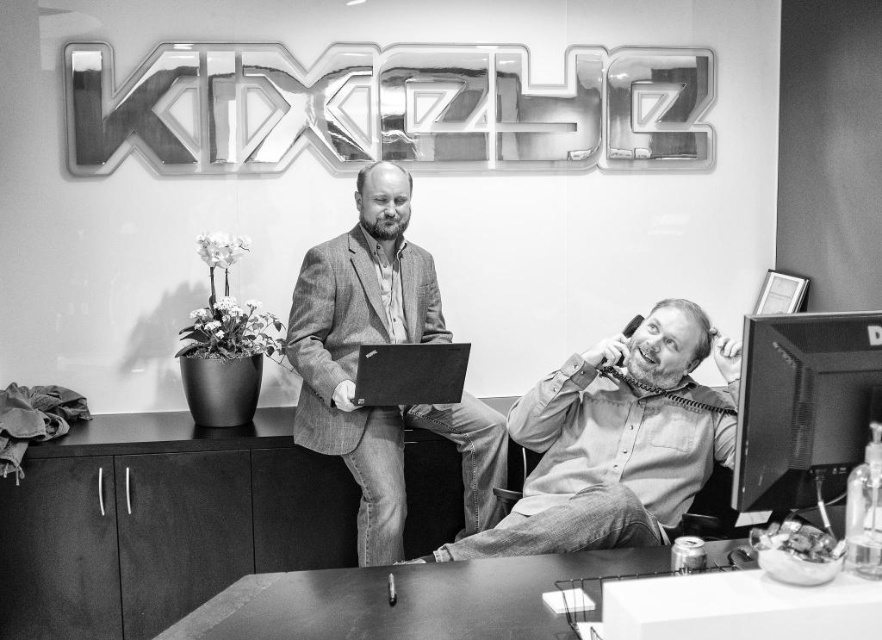
Is point (377, 602) behind point (774, 504)?

Yes, it is behind point (774, 504).

Is smooth wooden table at lower center behind matte black monitor at right?

Yes.

Is point (719, 560) farther from camera compared to point (748, 387)?

Yes, point (719, 560) is behind point (748, 387).

You are a GUI agent. You are given a task and a screenshot of the screen. Output one action in this format:
    pyautogui.click(x=<x>, y=<y>)
    Task: Click on the smooth wooden table at lower center
    The image size is (882, 640).
    Given the screenshot: What is the action you would take?
    pyautogui.click(x=410, y=600)

Is point (766, 442) closer to viewer compared to point (405, 365)?

Yes.

Is matte black monitor at right thinner than black matte laptop at center?

Correct, matte black monitor at right's width is less than black matte laptop at center's.

Is point (761, 376) less distant than point (371, 392)?

That is True.

You are a GUI agent. You are given a task and a screenshot of the screen. Output one action in this format:
    pyautogui.click(x=<x>, y=<y>)
    Task: Click on the matte black monitor at right
    This screenshot has height=640, width=882.
    Given the screenshot: What is the action you would take?
    pyautogui.click(x=804, y=406)

Does light gray shirt at center have a lesser width compared to textured gray blazer at center?

In fact, light gray shirt at center might be wider than textured gray blazer at center.

Who is positioned more to the right, light gray shirt at center or textured gray blazer at center?

light gray shirt at center

Where is `light gray shirt at center`? light gray shirt at center is located at coordinates (617, 442).

This screenshot has height=640, width=882. I want to click on light gray shirt at center, so click(x=617, y=442).